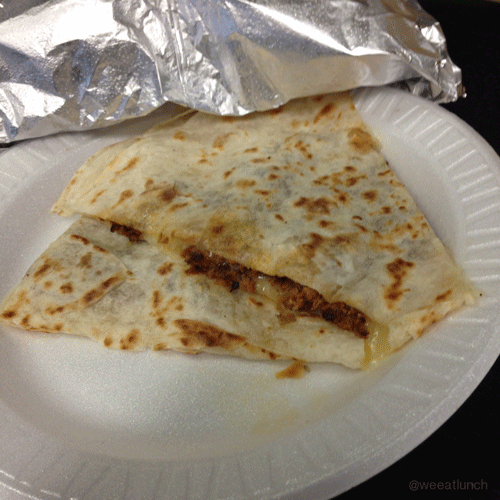
This screenshot has width=500, height=500. What are the coordinates of `napkin` in the screenshot? It's located at (492, 80).